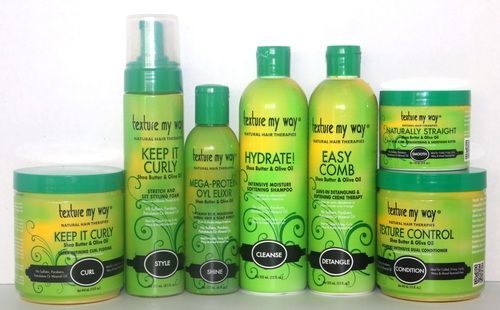
Identify the location of bottles. (153, 147), (209, 161), (283, 120), (334, 120).